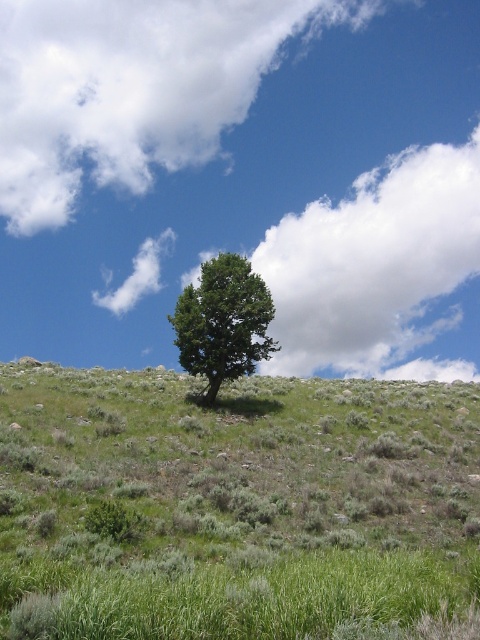
Between point (85, 634) and point (180, 168), which one is positioned in front?

Point (85, 634)

Between green grassy hillside at center and white fluffy cloud at upper center, which one appears on the right side from the viewer's perspective?

green grassy hillside at center is more to the right.

The width and height of the screenshot is (480, 640). Describe the element at coordinates (236, 508) in the screenshot. I see `green grassy hillside at center` at that location.

The height and width of the screenshot is (640, 480). In order to click on green grassy hillside at center in this screenshot , I will do `click(236, 508)`.

From the picture: Can you confirm if green grassy hillside at center is thinner than green leafy tree at center?

No.

Describe the element at coordinates (236, 508) in the screenshot. Image resolution: width=480 pixels, height=640 pixels. I see `green grassy hillside at center` at that location.

This screenshot has width=480, height=640. Identify the location of green grassy hillside at center. (236, 508).

At what (x,y) coordinates should I click in order to perform the action: click on green grassy hillside at center. Please return your answer as a coordinate pair (x, y). The height and width of the screenshot is (640, 480). Looking at the image, I should click on (236, 508).

Can you confirm if white fluffy cloud at upper center is positioned to the left of green leafy tree at center?

Yes, white fluffy cloud at upper center is to the left of green leafy tree at center.

Identify the location of white fluffy cloud at upper center. (132, 90).

Who is more distant from viewer, [172,4] or [244,257]?

Point [172,4]

This screenshot has height=640, width=480. I want to click on white fluffy cloud at upper center, so click(x=132, y=90).